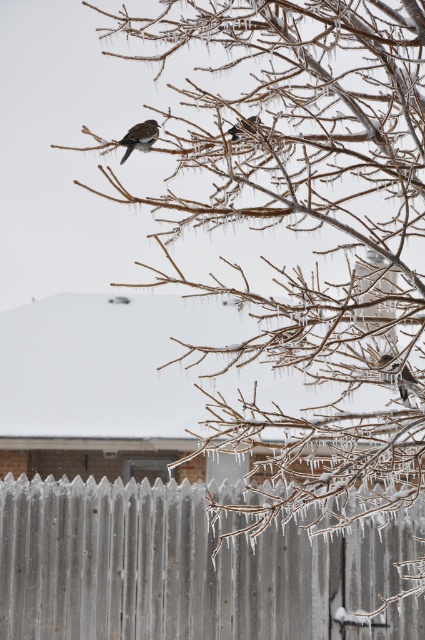
Which is above, gray corrugated fence at lower center or brown speckled feathers at upper center?

brown speckled feathers at upper center

Is the position of gray corrugated fence at lower center less distant than that of brown speckled feathers at upper center?

No, gray corrugated fence at lower center is further to the viewer.

Between point (223, 552) and point (248, 116), which one is positioned in front?

Point (248, 116) is in front.

You are a GUI agent. You are given a task and a screenshot of the screen. Output one action in this format:
    pyautogui.click(x=<x>, y=<y>)
    Task: Click on the gray corrugated fence at lower center
    
    Given the screenshot: What is the action you would take?
    pyautogui.click(x=175, y=566)

The height and width of the screenshot is (640, 425). In order to click on brown speckled feathers at upper right in this screenshot , I will do `click(396, 376)`.

Which is in front, point (385, 378) or point (141, 134)?

Point (385, 378) is in front.

At what (x,y) coordinates should I click in order to perform the action: click on brown speckled feathers at upper right. Please return your answer as a coordinate pair (x, y). The width and height of the screenshot is (425, 640). Looking at the image, I should click on (396, 376).

Is gray corrugated fence at lower center above brown speckled feathers at upper left?

No, gray corrugated fence at lower center is not above brown speckled feathers at upper left.

Which is in front, point (147, 540) or point (122, 163)?

Point (122, 163) is more forward.

Find the location of a particular element. gray corrugated fence at lower center is located at coordinates (175, 566).